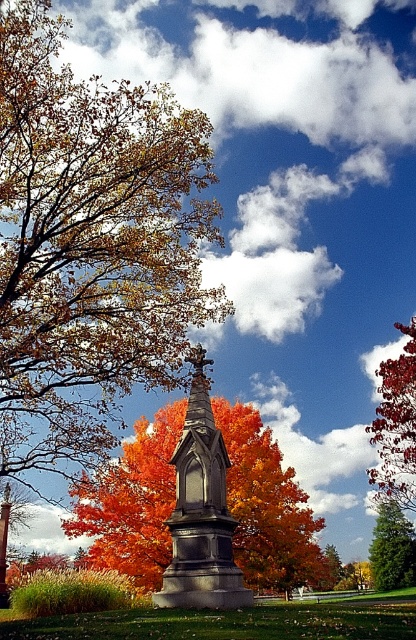
Consider the image. You are standing in the park and want to take a photo of the monument. The camera you have can focus on objects up to 50 meters away. Is the point at coordinates point (230,451) within the camera focus range?

The point at coordinates point (230,451) is 42.92 meters away from the camera, which is within the camera focus range of up to 50 meters. Yes, the point is within range.

You are a landscape photographer planning to capture the autumn leaves and the monument in a single shot. Given that the autumn leaves at center and the granite monument at center are both in the frame, which object would appear more prominent in terms of visual size in your photograph?

The autumn leaves at center would appear more prominent in visual size compared to the granite monument at center because they are described as having a larger size.

You are standing at the monument in the park and see the point marked at coordinates point (x=91, y=248). What is the location of this point relative to the autumn leaves at center?

The point (x=91, y=248) is located on the autumn leaves at center.